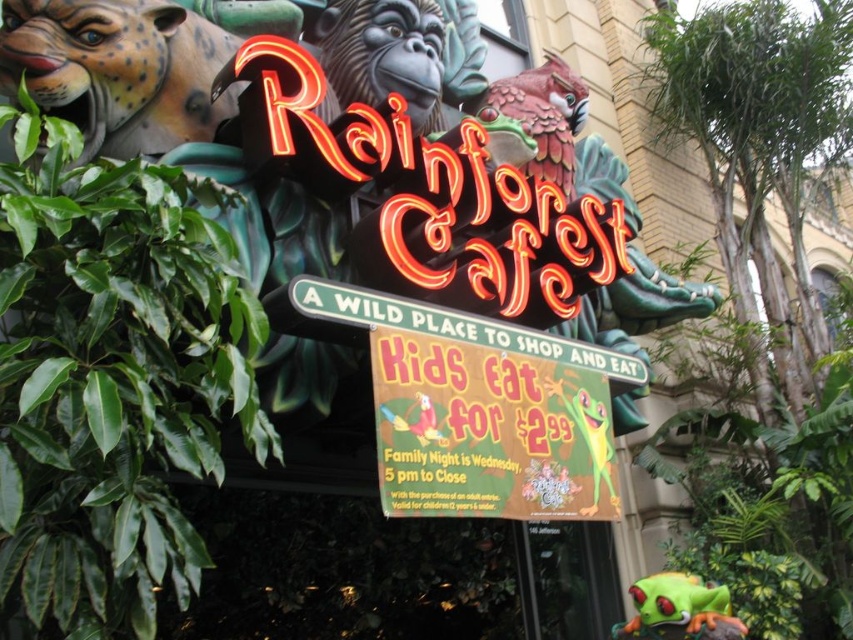
Question: From the image, what is the correct spatial relationship of shiny metallic parrot at upper center in relation to green matte frog at center?

Choices:
 (A) above
 (B) below

Answer: (A)

Question: Which object is positioned farthest from the green plastic street sign at center?

Choices:
 (A) green matte frog at center
 (B) shiny metallic parrot at upper center
 (C) bright yellow paper sign at center

Answer: (B)

Question: Is green plastic street sign at center wider than green matte frog at center?

Choices:
 (A) no
 (B) yes

Answer: (B)

Question: Among these objects, which one is farthest from the camera?

Choices:
 (A) green matte frog at center
 (B) bright yellow paper sign at center
 (C) green plastic street sign at center
 (D) shiny metallic parrot at upper center

Answer: (D)

Question: Does bright yellow paper sign at center have a smaller size compared to green plastic street sign at center?

Choices:
 (A) no
 (B) yes

Answer: (A)

Question: Based on their relative distances, which object is nearer to the green plastic street sign at center?

Choices:
 (A) shiny metallic parrot at upper center
 (B) bright yellow paper sign at center
 (C) green matte frog at center

Answer: (B)